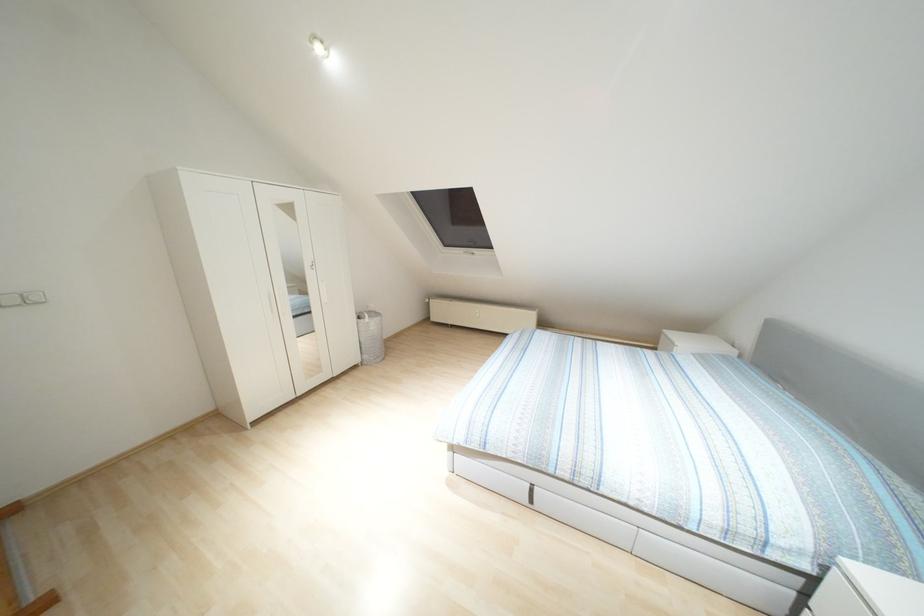
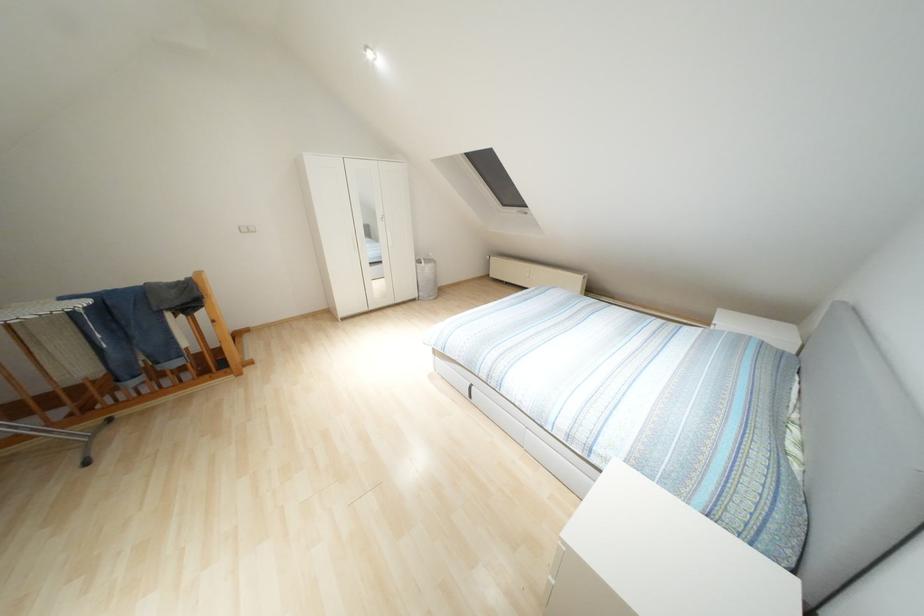
The point at (371,323) is marked in the first image. Where is the corresponding point in the second image?

(426, 268)